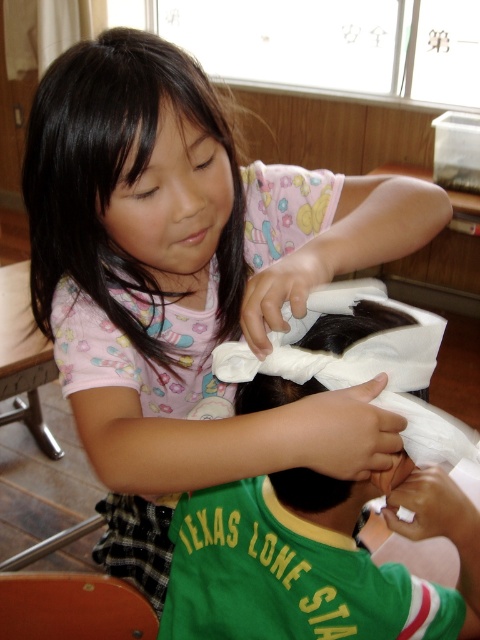
You are a teacher observing a student in a classroom. You notice the white paper towel at center and the black silky hair at upper left. Which object is taller?

The white paper towel at center is taller than the black silky hair at upper left.

The scene shows a girl with a cloth wrapped around a small animal. There is a white paper towel at center and a black silky hair at upper left. Which object is positioned to the right of the other?

The white paper towel at center is to the right of the black silky hair at upper left.